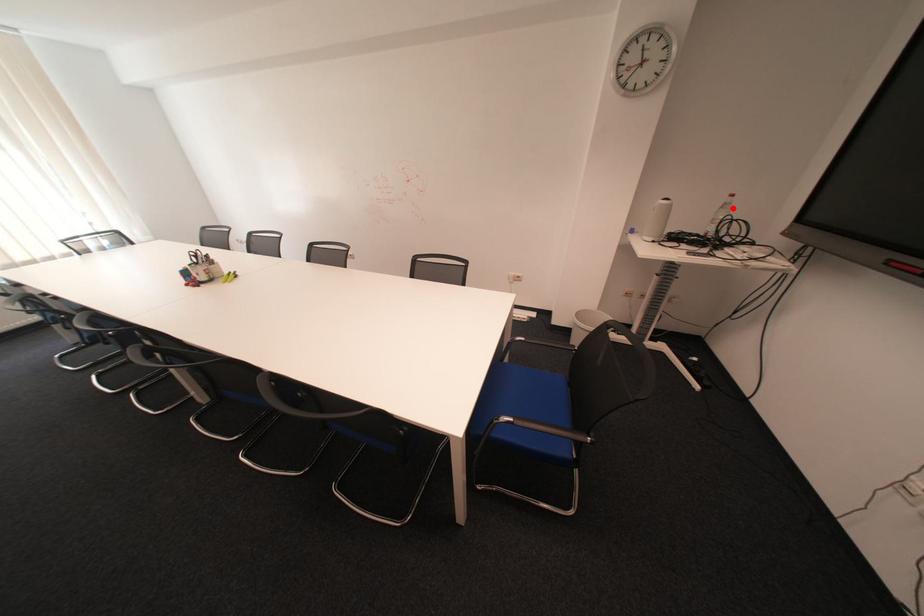
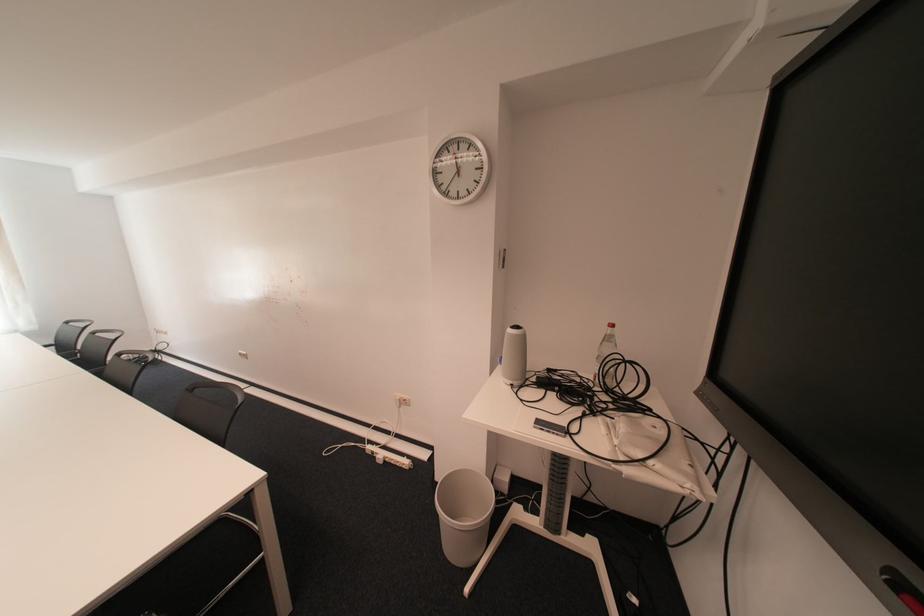
The point at the highlighted location is marked in the first image. Where is the corresponding point in the second image?

(614, 341)